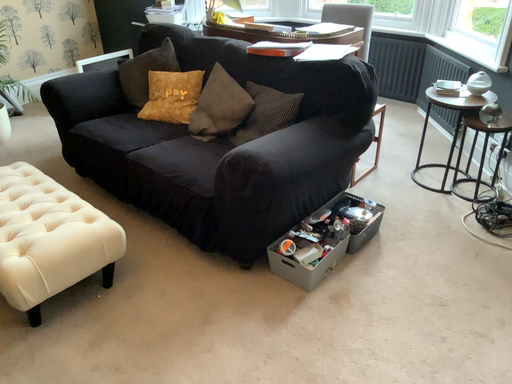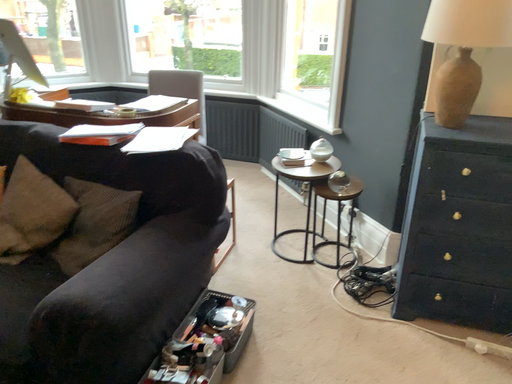
Question: How did the camera likely rotate when shooting the video?

Choices:
 (A) rotated upward
 (B) rotated downward

Answer: (A)